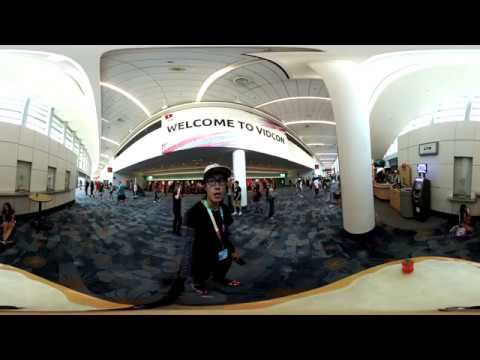
I want to click on countertop, so click(358, 287).